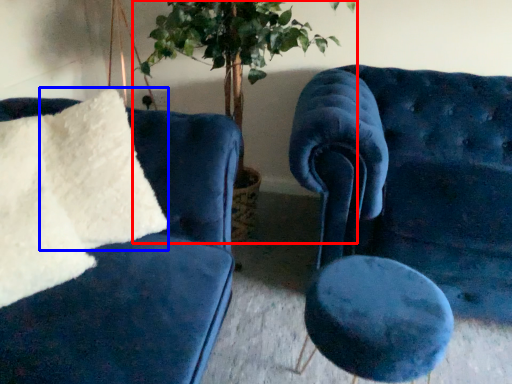
Question: Which point is closer to the camera, houseplant (highlighted by a red box) or pillow (highlighted by a blue box)?

Choices:
 (A) houseplant
 (B) pillow

Answer: (B)